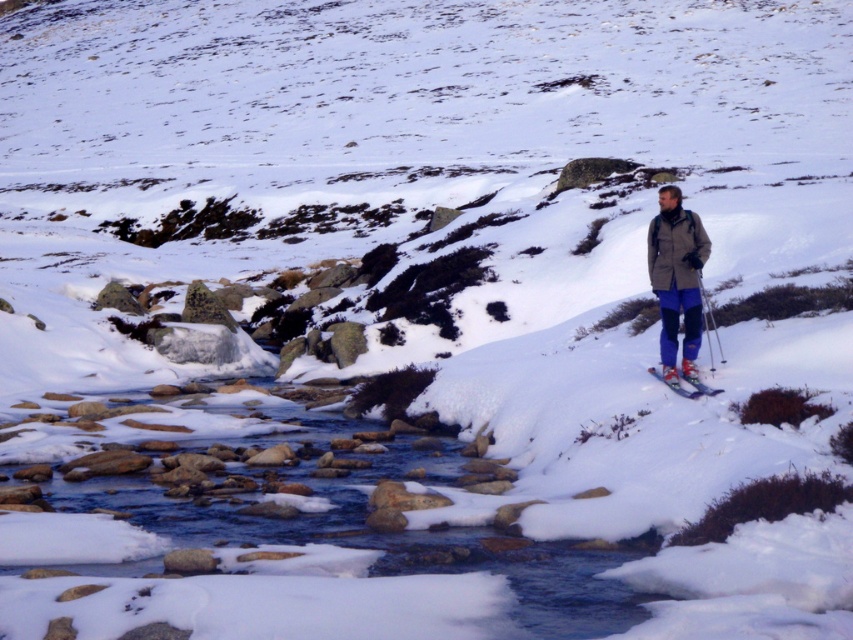
You are standing at the edge of the stream and see the matte gray jacket at right and the matte blue ski at center right. Which item is closer to your right side?

The matte gray jacket at right is closer to your right side because it is positioned to the right of the matte blue ski at center right.

You are standing at the edge of the stream and see the matte gray jacket at right and the matte blue ski at center right. Which object is taller?

The matte gray jacket at right is much taller than the matte blue ski at center right.